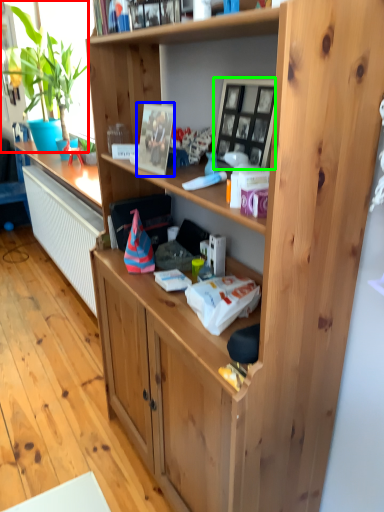
Question: Estimate the real-world distances between objects in this image. Which object is farther from houseplant (highlighted by a red box), picture frame (highlighted by a blue box) or picture frame (highlighted by a green box)?

Choices:
 (A) picture frame
 (B) picture frame

Answer: (B)